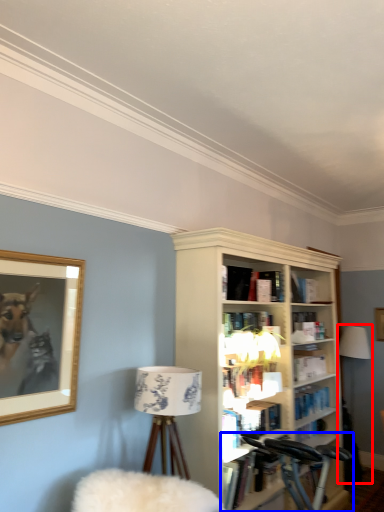
Question: Which object is closer to the camera taking this photo, table lamp (highlighted by a red box) or bicycle (highlighted by a blue box)?

Choices:
 (A) table lamp
 (B) bicycle

Answer: (B)